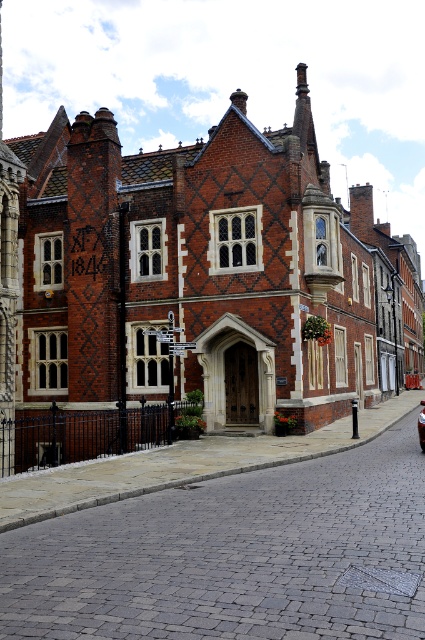
You are standing on the cobblestone street in front of the brick building at center and the shiny red car at center. Which object is positioned higher relative to the ground?

The brick building at center is positioned higher than the shiny red car at center because it is above it.

You are standing in front of the historic brick building and notice two points marked on the facade. The first point is at coordinate point (x=127, y=394) and the second is at point (x=422, y=403). Which point is closer to you?

Point (x=127, y=394) is closer to the viewer than point (x=422, y=403).

From the picture: You are standing on the cobblestone street in front of the historic brick building. There is a specific point marked at coordinates (198, 285). What object is located at this point?

The brick building at center is located at point (198, 285).